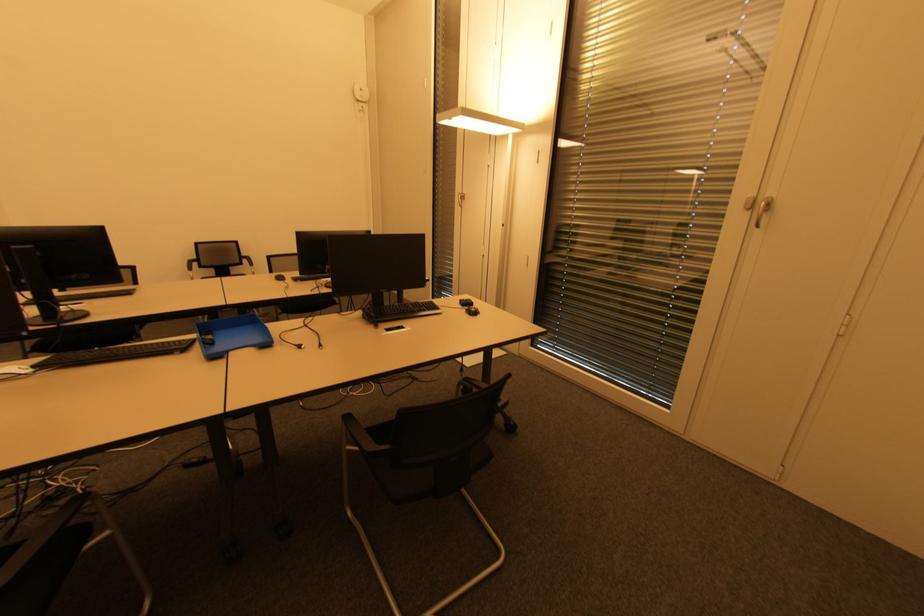
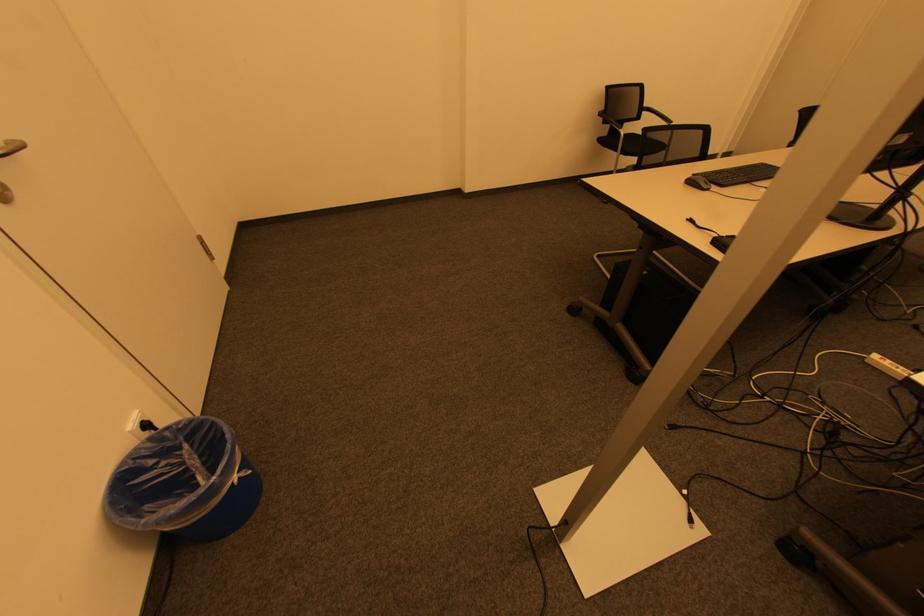
Question: Which direction would the cameraman need to move to produce the second image? Reply with the corresponding letter.

Choices:
 (A) Left
 (B) Right
 (C) Forward
 (D) Backward

Answer: (A)